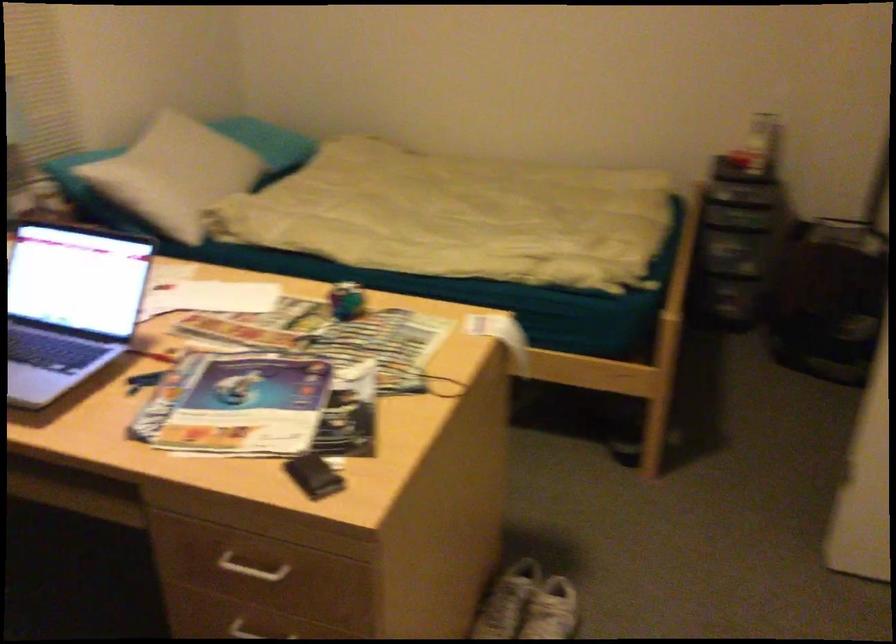
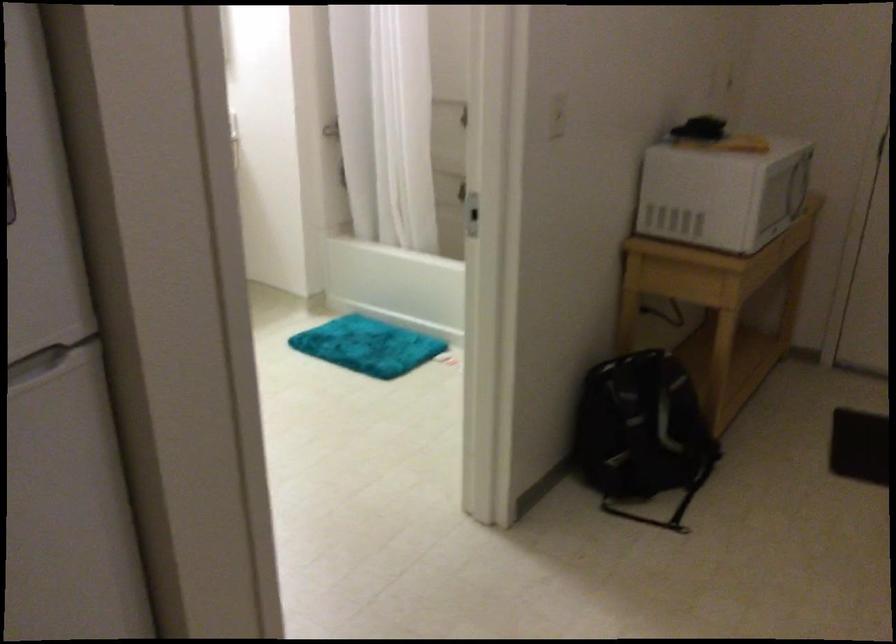
Based on the continuous images, in which direction is the camera rotating?

The camera's rotation is toward right-down.